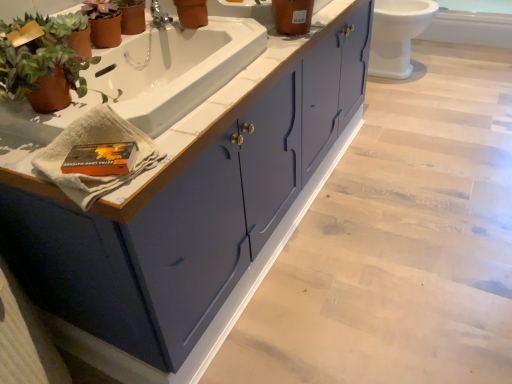
Question: In terms of height, does white glossy sink at upper center look taller or shorter compared to matte blue cabinet at center?

Choices:
 (A) short
 (B) tall

Answer: (A)

Question: Choose the correct answer: Is white glossy sink at upper center inside matte blue cabinet at center or outside it?

Choices:
 (A) outside
 (B) inside

Answer: (B)

Question: Based on their relative distances, which object is nearer to the white glossy toilet at upper right?

Choices:
 (A) terracotta clay pot at left
 (B) silver metallic faucet at upper center
 (C) white glossy sink at upper center
 (D) matte orange pot at upper center
 (E) matte blue cabinet at center

Answer: (E)

Question: Based on their relative distances, which object is nearer to the white glossy sink at upper center?

Choices:
 (A) terracotta clay pot at left
 (B) silver metallic faucet at upper center
 (C) white glossy toilet at upper right
 (D) matte blue cabinet at center
 (E) matte orange pot at upper center

Answer: (A)